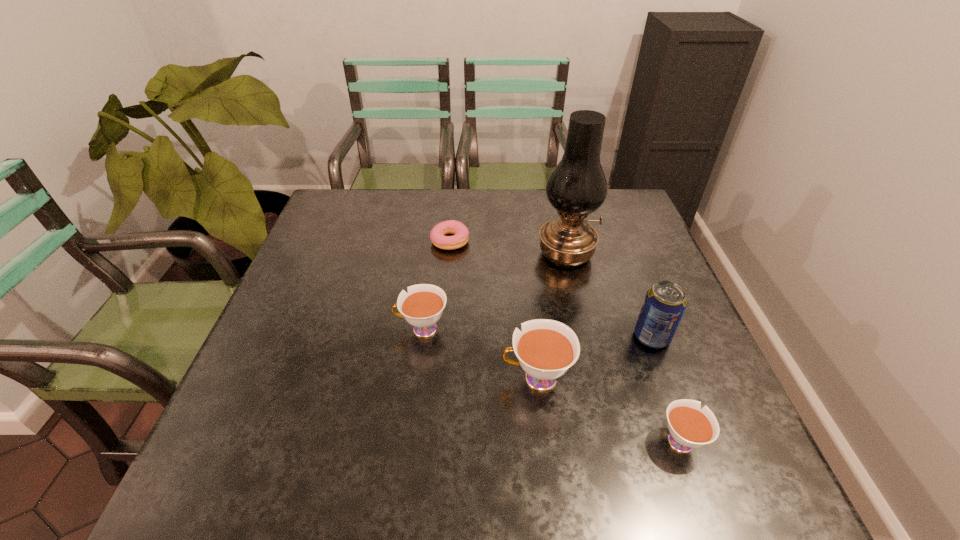
All teacups are currently evenly spaced. To continue this pattern, where would you add another teacup on the left? Please point out a vacant spot. Please provide its 2D coordinates. Your answer should be formatted as a tuple, i.e. [(x, y)], where the tuple contains the x and y coordinates of a point satisfying the conditions above.

[(327, 288)]